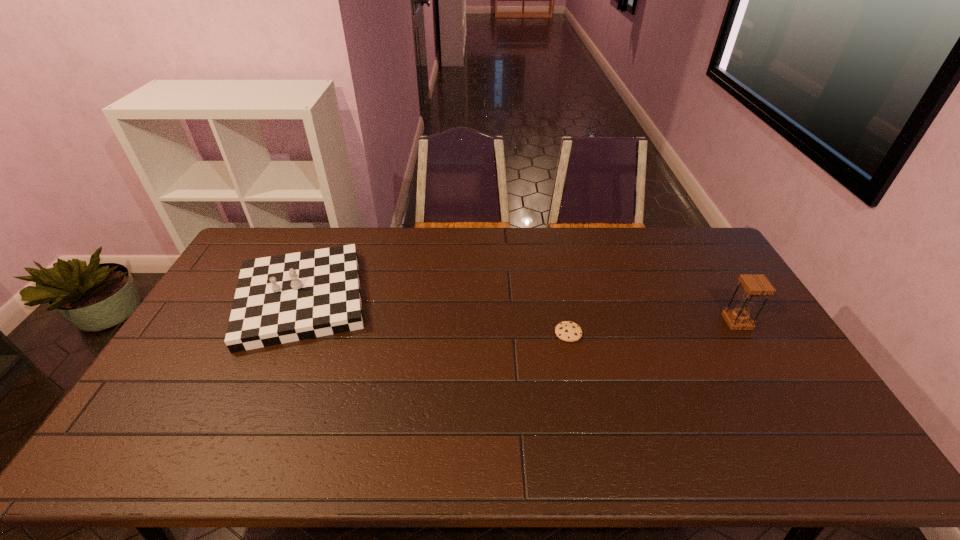
Identify the location of the rightmost object. (755, 285).

The width and height of the screenshot is (960, 540). I want to click on hourglass, so click(755, 285).

In order to click on the second shortest object in this screenshot , I will do [279, 299].

The width and height of the screenshot is (960, 540). Identify the location of checkerboard. (279, 299).

Find the location of a particular element. This screenshot has height=540, width=960. cookie is located at coordinates (568, 331).

Image resolution: width=960 pixels, height=540 pixels. Find the location of `the second object from right to left`. the second object from right to left is located at coordinates (568, 331).

Find the location of a particular element. vacant point located 0.090m on the back of the rightmost object is located at coordinates (720, 294).

You are a GUI agent. You are given a task and a screenshot of the screen. Output one action in this format:
    pyautogui.click(x=<x>, y=<y>)
    Task: Click on the vacant space located 0.350m on the right of the leftmost object
    Image resolution: width=960 pixels, height=540 pixels.
    Given the screenshot: What is the action you would take?
    pyautogui.click(x=478, y=298)

I want to click on free space located on the right of the second object from left to right, so click(x=628, y=333).

Find the location of a particular element. This screenshot has height=540, width=960. object present at the far edge is located at coordinates (279, 299).